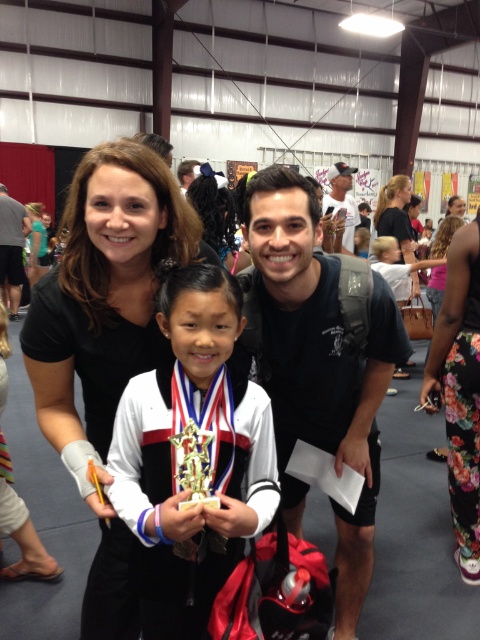
Question: Among these points, which one is farthest from the camera?

Choices:
 (A) (216, 241)
 (B) (130, 422)
 (C) (149, 264)
 (D) (436, 252)

Answer: (D)

Question: Does gold metallic trophy at center appear on the right side of gray fabric shirt at center?

Choices:
 (A) yes
 (B) no

Answer: (A)

Question: Where is black matte shirt at upper left located in relation to black hair at center in the image?

Choices:
 (A) below
 (B) above

Answer: (A)

Question: Among these objects, which one is nearest to the camera?

Choices:
 (A) floral fabric pants at lower right
 (B) black hair at center

Answer: (A)

Question: Is gray fabric shirt at center to the right of matte black hair at upper center from the viewer's perspective?

Choices:
 (A) yes
 (B) no

Answer: (B)

Question: Which of these objects is positioned closest to the white matte baseball cap at upper center?

Choices:
 (A) matte black hair at upper center
 (B) black matte t-shirt at center

Answer: (A)